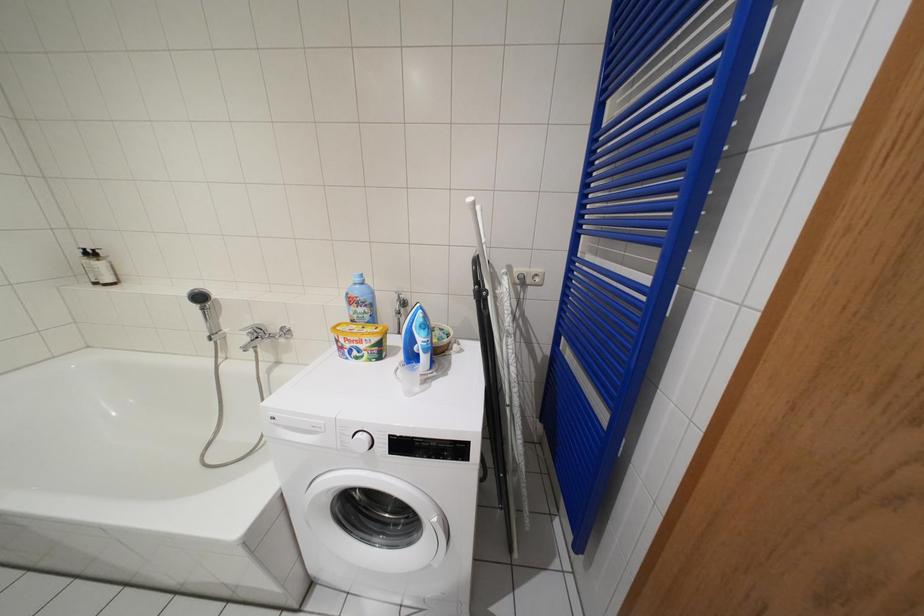
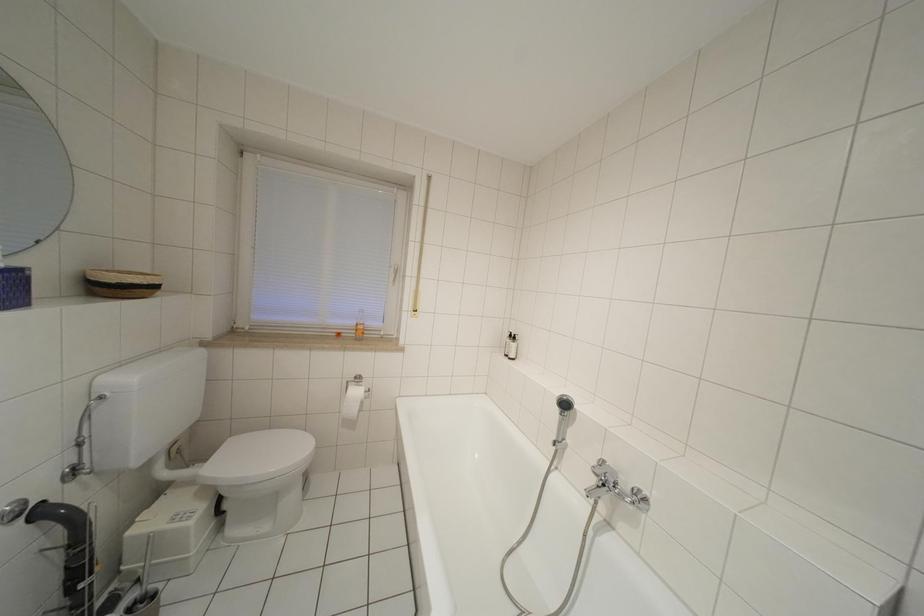
Question: How did the camera likely rotate?

Choices:
 (A) Left
 (B) Right
 (C) Up
 (D) Down

Answer: (A)